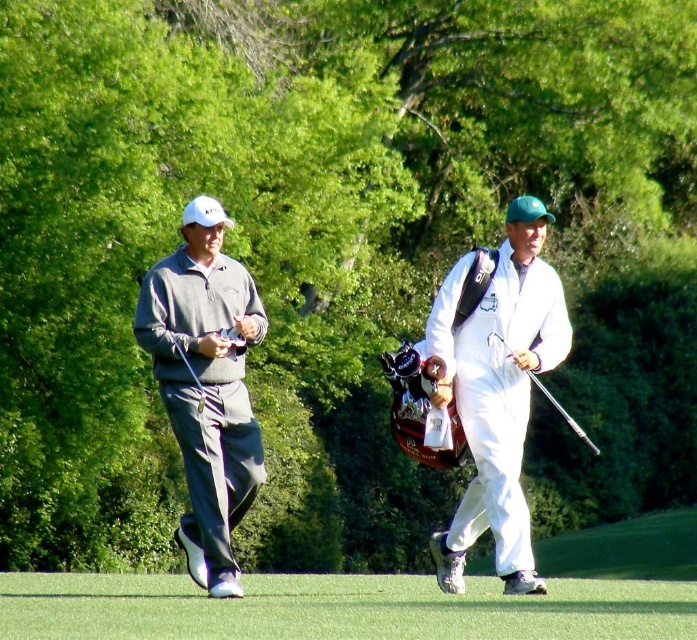
Question: Which of the following is the closest to the observer?

Choices:
 (A) green turf at lower center
 (B) white matte golf bag at center
 (C) gray sweater at center

Answer: (A)

Question: Which object is positioned closest to the matte gray sweater at left?

Choices:
 (A) green turf at lower center
 (B) gray sweater at center
 (C) metallic silver golf club at right
 (D) white matte golf bag at center

Answer: (B)

Question: Can you confirm if green turf at lower center is wider than white matte golf bag at center?

Choices:
 (A) yes
 (B) no

Answer: (A)

Question: Is white matte golf bag at center thinner than matte gray sweater at left?

Choices:
 (A) no
 (B) yes

Answer: (B)

Question: Among these objects, which one is nearest to the camera?

Choices:
 (A) white matte golf bag at center
 (B) matte gray sweater at left
 (C) metallic silver golf club at right

Answer: (C)

Question: Can you confirm if gray sweater at center is wider than white matte golf bag at center?

Choices:
 (A) no
 (B) yes

Answer: (B)